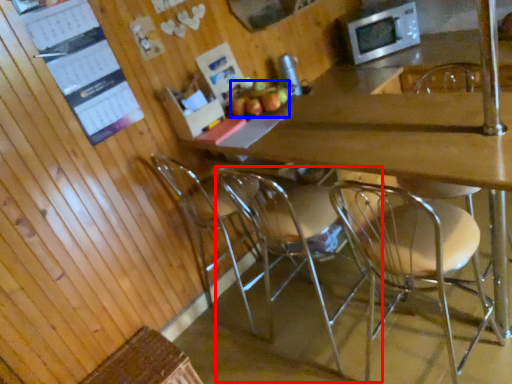
Question: Which of the following is the farthest to the observer, chair (highlighted by a red box) or apple (highlighted by a blue box)?

Choices:
 (A) chair
 (B) apple

Answer: (B)